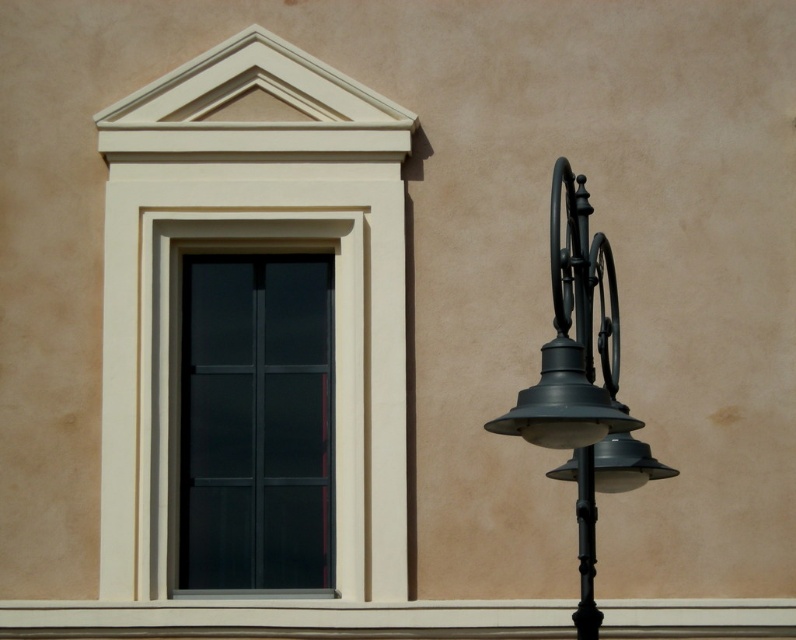
You are standing in front of a building and see the matte black window at center and the matte black street light at right. Which object is positioned lower from the ground?

The matte black window at center is positioned lower from the ground than the matte black street light at right because it is located below it.

You are a painter standing at the base of the building. You need to paint both the matte black window at center and the matte black street light at right. Which object will require you to use a longer ladder to reach its top?

The matte black window at center is much taller than the matte black street light at right, so you will need a longer ladder to reach the top of the matte black window at center.

You are standing in front of a building and want to take a photo of the matte black window at center. If you are currently 14.61 meters away from it, is this distance within the recommended 15 meters for capturing clear details?

The distance between you and the matte black window at center is exactly 14.61 meters, which is within the recommended 15 meters for capturing clear details, so yes, this distance is suitable.